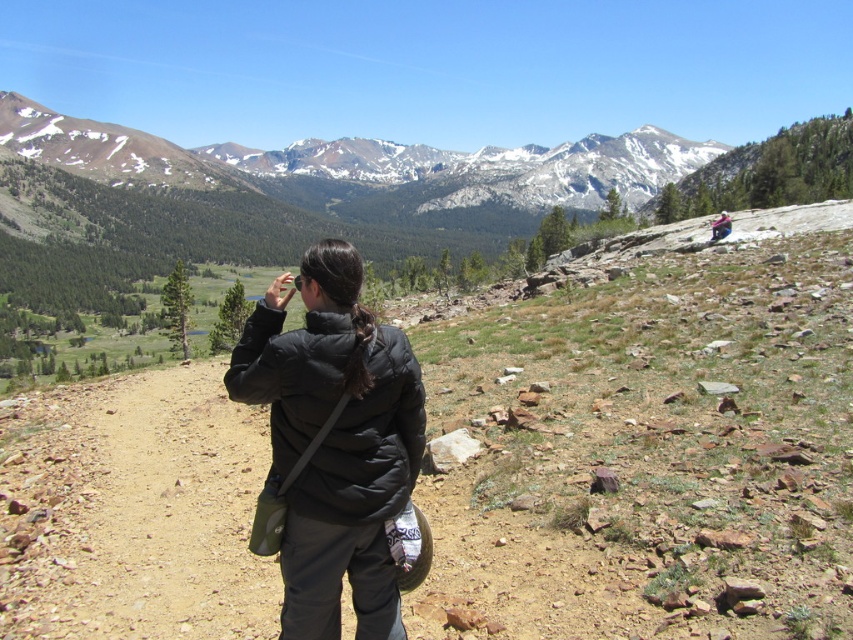
Who is higher up, black puffer jacket at center or matte black jacket at upper right?

Positioned higher is matte black jacket at upper right.

Who is lower down, black puffer jacket at center or matte black jacket at upper right?

black puffer jacket at center is below.

Identify the location of black puffer jacket at center. (334, 440).